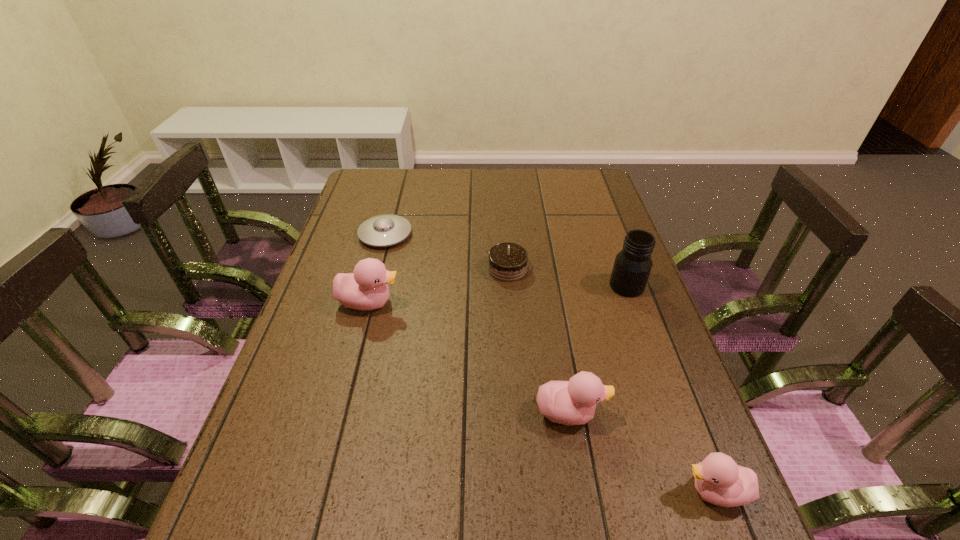
Locate an element on the screen. This screenshot has height=540, width=960. duckling that is at the right edge is located at coordinates (719, 480).

Find the location of `jar positioned at the right edge`. jar positioned at the right edge is located at coordinates (632, 266).

Where is `object positioned at the near right corner`? The image size is (960, 540). object positioned at the near right corner is located at coordinates (719, 480).

The height and width of the screenshot is (540, 960). In the image, there is a desktop. Find the location of `vacant space at the far edge`. vacant space at the far edge is located at coordinates (541, 185).

Where is `vacant space at the near edge`? vacant space at the near edge is located at coordinates (425, 484).

Locate an element on the screen. The image size is (960, 540). vacant space at the left edge of the desktop is located at coordinates (328, 299).

You are a GUI agent. You are given a task and a screenshot of the screen. Output one action in this format:
    pyautogui.click(x=<x>, y=<y>)
    Task: Click on the free region at the right edge
    
    Given the screenshot: What is the action you would take?
    pyautogui.click(x=597, y=218)

In the image, there is a desktop. At what (x,y) coordinates should I click in order to perform the action: click on free space at the far left corner. Please return your answer as a coordinate pair (x, y). Looking at the image, I should click on (387, 200).

The image size is (960, 540). In order to click on free space at the far right corner of the desktop in this screenshot , I will do pos(594,198).

At what (x,y) coordinates should I click in order to perform the action: click on vacant space in between the farthest duckling and the second shortest object. Please return your answer as a coordinate pair (x, y). The height and width of the screenshot is (540, 960). Looking at the image, I should click on (439, 286).